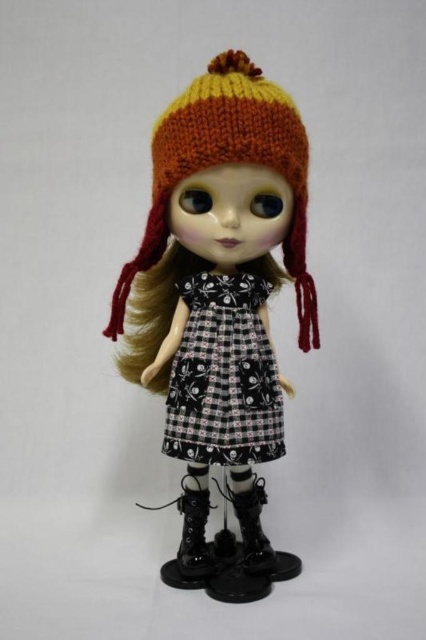
You are a fashion designer who wants to place a new accessory between the black printed fabric dress at center and the black leather boot at lower center. The accessory is 3 inches wide. Is there enough space between them to fit the accessory?

The black printed fabric dress at center and black leather boot at lower center are 6.97 inches apart from each other. Since the accessory is 3 inches wide, there is enough space between them to fit the accessory.

You are standing in front of the doll and want to know how far the point at coordinates point (244, 364) is from your eyes. Can you determine the distance?

The point (244, 364) is 3.57 feet away from the camera, so the distance from your eyes would depend on your position relative to the camera. If you are positioned where the camera is, then the distance would be 3.57 feet.